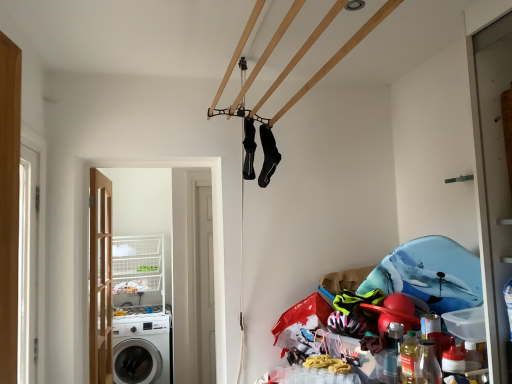
Question: Is white wire basket at lower left closer to camera compared to black matte socks at upper center, marked as the 1th clothing in a right-to-left arrangement?

Choices:
 (A) no
 (B) yes

Answer: (A)

Question: From a real-world perspective, is white wire basket at lower left beneath black matte socks at upper center, marked as the 1th clothing in a right-to-left arrangement?

Choices:
 (A) yes
 (B) no

Answer: (A)

Question: Is white wire basket at lower left placed right next to black matte socks at upper center, marked as the 2th clothing in a left-to-right arrangement?

Choices:
 (A) yes
 (B) no

Answer: (B)

Question: Is white wire basket at lower left located outside black matte socks at upper center, marked as the 1th clothing in a right-to-left arrangement?

Choices:
 (A) no
 (B) yes

Answer: (B)

Question: Can you confirm if white wire basket at lower left is taller than black matte socks at upper center, marked as the 1th clothing in a right-to-left arrangement?

Choices:
 (A) no
 (B) yes

Answer: (B)

Question: Is white wire basket at lower left positioned behind black matte socks at upper center, marked as the 1th clothing in a right-to-left arrangement?

Choices:
 (A) no
 (B) yes

Answer: (B)

Question: Is black matte socks at center, the second clothing in the right-to-left sequence, facing towards black matte socks at upper center, marked as the 1th clothing in a right-to-left arrangement?

Choices:
 (A) yes
 (B) no

Answer: (A)

Question: Is black matte socks at center, the second clothing in the right-to-left sequence, closer to camera compared to black matte socks at upper center, marked as the 1th clothing in a right-to-left arrangement?

Choices:
 (A) yes
 (B) no

Answer: (A)

Question: Is black matte socks at center, the second clothing in the right-to-left sequence, facing away from black matte socks at upper center, marked as the 2th clothing in a left-to-right arrangement?

Choices:
 (A) no
 (B) yes

Answer: (B)

Question: Can you confirm if black matte socks at center, the 1th clothing viewed from the left, is wider than black matte socks at upper center, marked as the 1th clothing in a right-to-left arrangement?

Choices:
 (A) yes
 (B) no

Answer: (B)

Question: From the image's perspective, is black matte socks at center, the second clothing in the right-to-left sequence, located beneath black matte socks at upper center, marked as the 1th clothing in a right-to-left arrangement?

Choices:
 (A) no
 (B) yes

Answer: (A)

Question: Is black matte socks at center, the second clothing in the right-to-left sequence, positioned far away from black matte socks at upper center, marked as the 1th clothing in a right-to-left arrangement?

Choices:
 (A) yes
 (B) no

Answer: (B)

Question: Does white wire basket at lower left appear on the left side of wooden door at left?

Choices:
 (A) yes
 (B) no

Answer: (A)